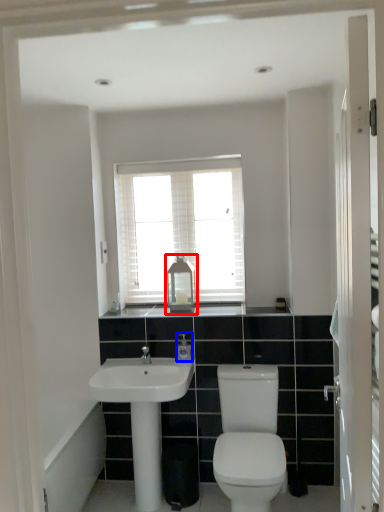
Question: Which point is closer to the camera, medicine cabinet (highlighted by a red box) or toiletry (highlighted by a blue box)?

Choices:
 (A) medicine cabinet
 (B) toiletry

Answer: (B)